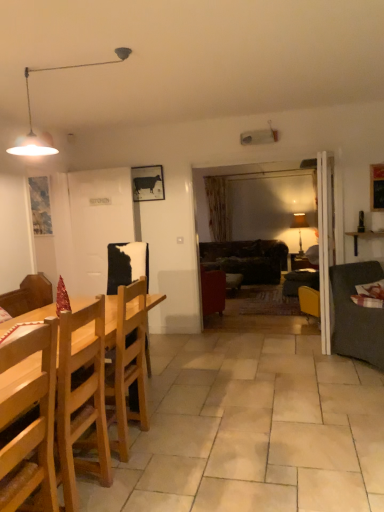
Locate an element on the screen. free space in front of light brown wooden chair at left, the first chair when ordered from back to front is located at coordinates (133, 485).